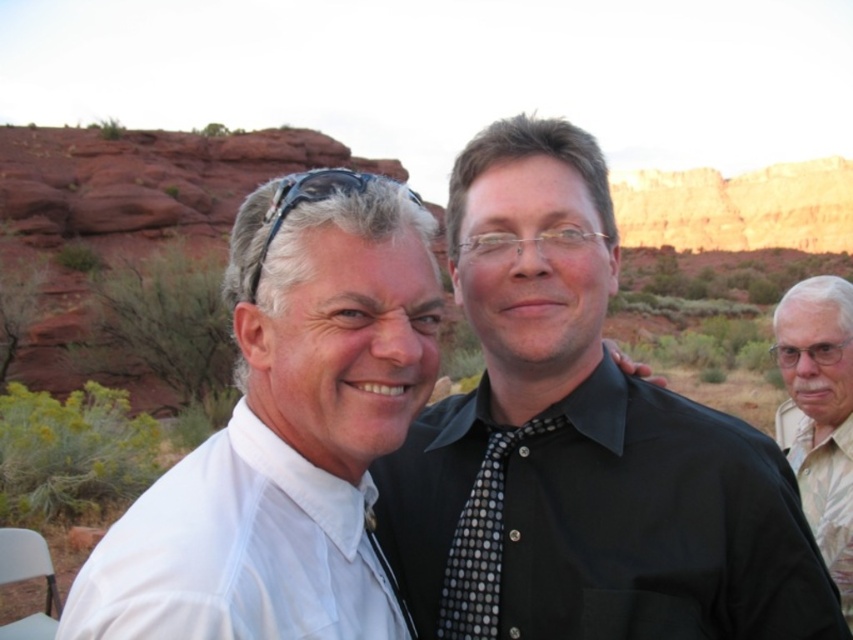
The width and height of the screenshot is (853, 640). Find the location of `white smooth shirt at left`. white smooth shirt at left is located at coordinates (236, 552).

Based on the photo, is white smooth shirt at left to the left of gray textured shirt at right from the viewer's perspective?

Correct, you'll find white smooth shirt at left to the left of gray textured shirt at right.

What are the coordinates of `white smooth shirt at left` in the screenshot? It's located at (236, 552).

Who is positioned more to the right, white shirt at center or black rubber sunglasses at upper left?

Positioned to the right is white shirt at center.

Which is behind, point (265, 384) or point (287, 177)?

The point (265, 384) is behind.

Between point (152, 614) and point (294, 173), which one is positioned behind?

Positioned behind is point (294, 173).

I want to click on white shirt at center, so click(286, 433).

Between white shirt at center and gray textured shirt at right, which one appears on the right side from the viewer's perspective?

Positioned to the right is gray textured shirt at right.

Is point (267, 568) behind point (830, 435)?

No, (267, 568) is closer to viewer.

The image size is (853, 640). Identify the location of white shirt at center. (286, 433).